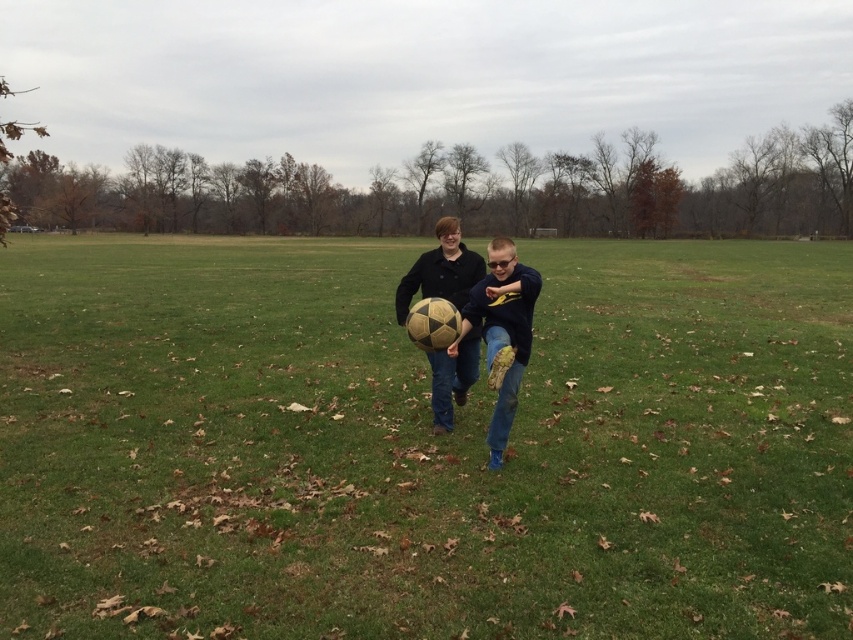
You are standing at the origin point of the image coordinate system. You want to kick the matte yellow soccer ball at center. Which direction should you move to reach it?

The matte yellow soccer ball at center is located at point coordinates of (x=502, y=333). Since the origin is at the bottom left corner, you should move to the right and upwards to reach it.

You are a photographer planning to take a picture of the green grass at center and the matte yellow soccer ball at center. Which object will occupy more space in the photo?

The green grass at center has a larger size compared to the matte yellow soccer ball at center, so it will occupy more space in the photo.

You are a photographer trying to capture a wide shot of the two people playing soccer on the green grass at center and the matte gold soccer ball at center. Based on their sizes, which object will occupy more space in your photo?

The green grass at center will occupy more space in the photo because its width is larger than that of the matte gold soccer ball at center.